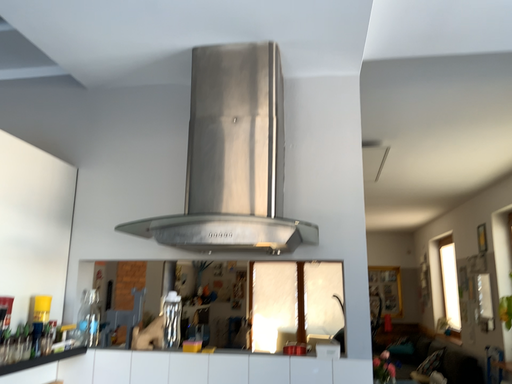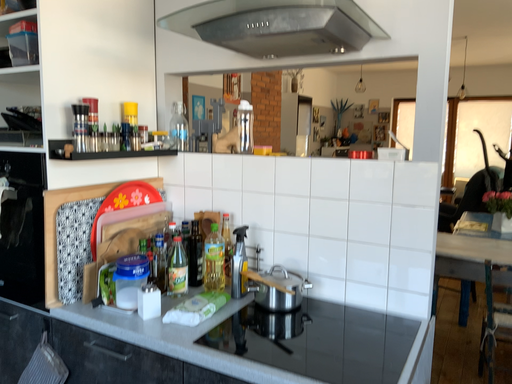
Question: Which way did the camera rotate in the video?

Choices:
 (A) rotated upward
 (B) rotated downward

Answer: (B)